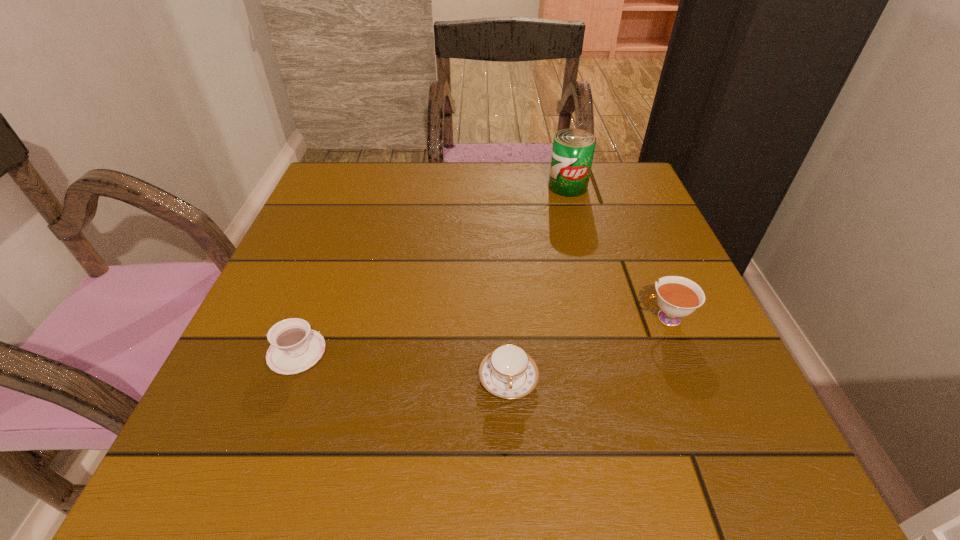
This screenshot has height=540, width=960. In the image, there is a desktop. In order to click on vacant space at the right edge in this screenshot , I will do `click(646, 233)`.

In the image, there is a desktop. Where is `vacant space at the far left corner`? Image resolution: width=960 pixels, height=540 pixels. vacant space at the far left corner is located at coordinates (358, 203).

I want to click on free location at the near left corner, so click(x=282, y=453).

I want to click on vacant space at the far right corner, so click(x=638, y=176).

The width and height of the screenshot is (960, 540). I want to click on vacant space at the near right corner, so click(x=684, y=437).

Locate an element on the screen. The image size is (960, 540). vacant area that lies between the third shortest object and the leftmost teacup is located at coordinates (481, 335).

Find the location of a particular element. free space between the farthest object and the second teacup from left to right is located at coordinates (538, 282).

You are a GUI agent. You are given a task and a screenshot of the screen. Output one action in this format:
    pyautogui.click(x=<x>, y=<y>)
    Task: Click on the unoccupied area between the leftmost teacup and the can
    Image resolution: width=960 pixels, height=540 pixels.
    Given the screenshot: What is the action you would take?
    pyautogui.click(x=432, y=269)

Where is `unoccupied position between the leftmost teacup and the tallest object`? The height and width of the screenshot is (540, 960). unoccupied position between the leftmost teacup and the tallest object is located at coordinates (432, 269).

The image size is (960, 540). Identify the location of free point between the leftmost teacup and the farthest object. (432, 269).